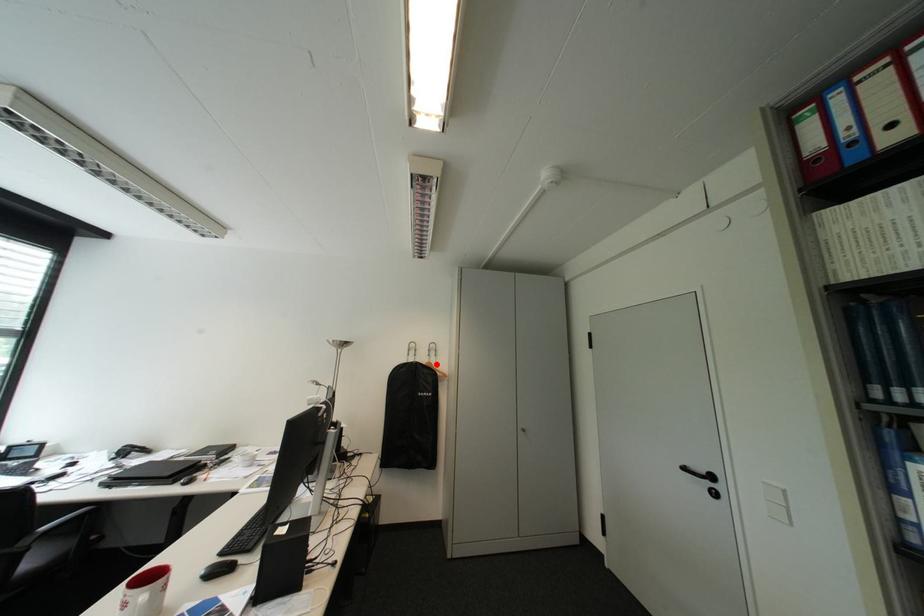
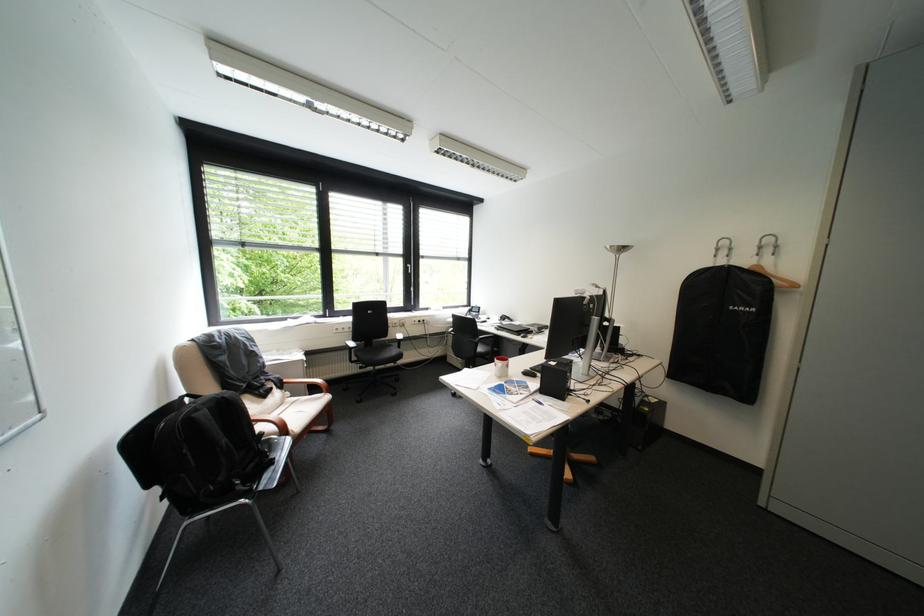
Locate, in the second image, the point that corresponds to the highlighted location in the first image.

(759, 268)